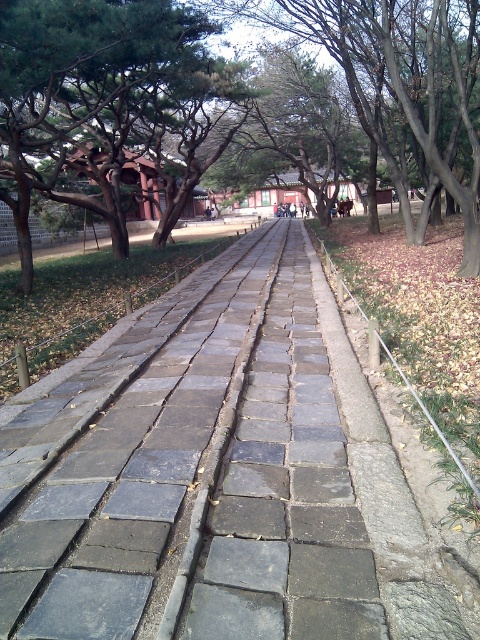
Does gray stone pavement at center appear on the left side of green leafy tree at center?

Indeed, gray stone pavement at center is positioned on the left side of green leafy tree at center.

Which of these two, gray stone pavement at center or green leafy tree at center, stands shorter?

With less height is gray stone pavement at center.

Where is `gray stone pavement at center`? Image resolution: width=480 pixels, height=640 pixels. gray stone pavement at center is located at coordinates tap(216, 476).